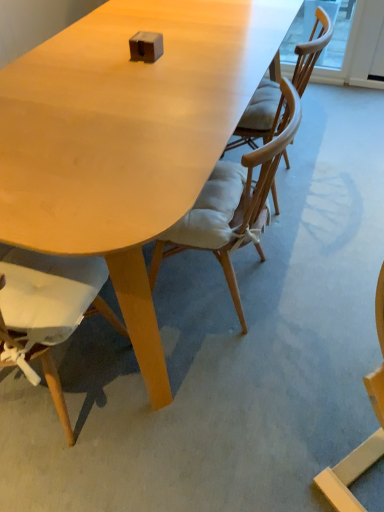
Identify the location of vacant area that is in front of wooden chair with cushion at center, placed as the 1th chair when sorted from right to left. (307, 248).